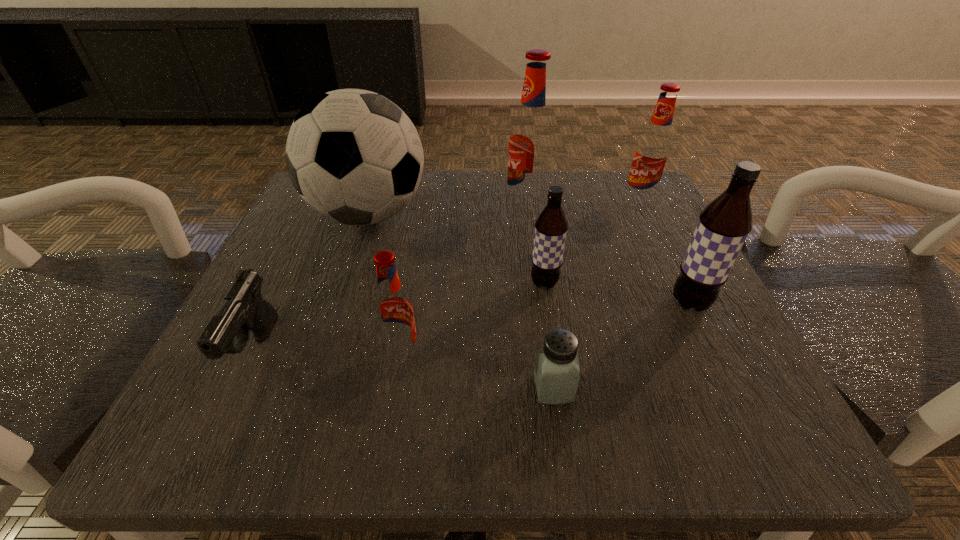
The image size is (960, 540). Find the location of `free spot between the saltshaker and the leftmost red root beer`. free spot between the saltshaker and the leftmost red root beer is located at coordinates (477, 371).

At what (x,y) coordinates should I click in order to perform the action: click on free spot between the bigger brown root beer and the saltshaker. Please return your answer as a coordinate pair (x, y). Looking at the image, I should click on (621, 346).

At what (x,y) coordinates should I click in order to perform the action: click on vacant area between the bigger brown root beer and the biggest red root beer. Please return your answer as a coordinate pair (x, y). Looking at the image, I should click on pyautogui.click(x=608, y=256).

Find the location of a particular element. the seventh closest object to the second smallest red root beer is located at coordinates (244, 309).

Identify the location of object that is the fifth closest to the second smallest red root beer. (556, 372).

Identify which root beer is the third closest to the soccer ball. Please provide its 2D coordinates. Your answer should be formatted as a tuple, i.e. [(x, y)], where the tuple contains the x and y coordinates of a point satisfying the conditions above.

[(393, 310)]

Choose which root beer is the fourth nearest neighbor to the saltshaker. Please provide its 2D coordinates. Your answer should be formatted as a tuple, i.e. [(x, y)], where the tuple contains the x and y coordinates of a point satisfying the conditions above.

[(531, 140)]

Locate an element on the screen. The height and width of the screenshot is (540, 960). the second closest red root beer to the saltshaker is located at coordinates (531, 140).

Identify which red root beer is located as the nearest to the saltshaker. Please provide its 2D coordinates. Your answer should be formatted as a tuple, i.e. [(x, y)], where the tuple contains the x and y coordinates of a point satisfying the conditions above.

[(393, 310)]

Locate an element on the screen. free location that satisfies the following two spatial constraints: 1. on the main logo of the black soccer ball; 2. at the barrel of the black pistol is located at coordinates (323, 350).